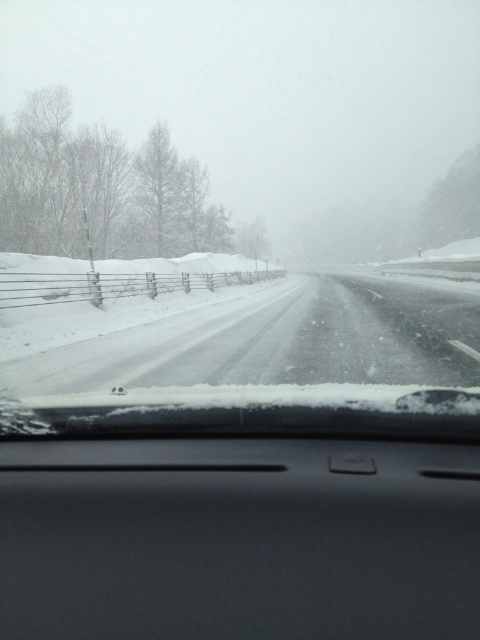
Does black matte dashboard at center have a greater height compared to snowy asphalt highway at center?

In fact, black matte dashboard at center may be shorter than snowy asphalt highway at center.

Can you confirm if black matte dashboard at center is thinner than snowy asphalt highway at center?

Yes.

Does point (298, 506) lie behind point (345, 312)?

That is False.

Where is `black matte dashboard at center`? This screenshot has width=480, height=640. black matte dashboard at center is located at coordinates (238, 538).